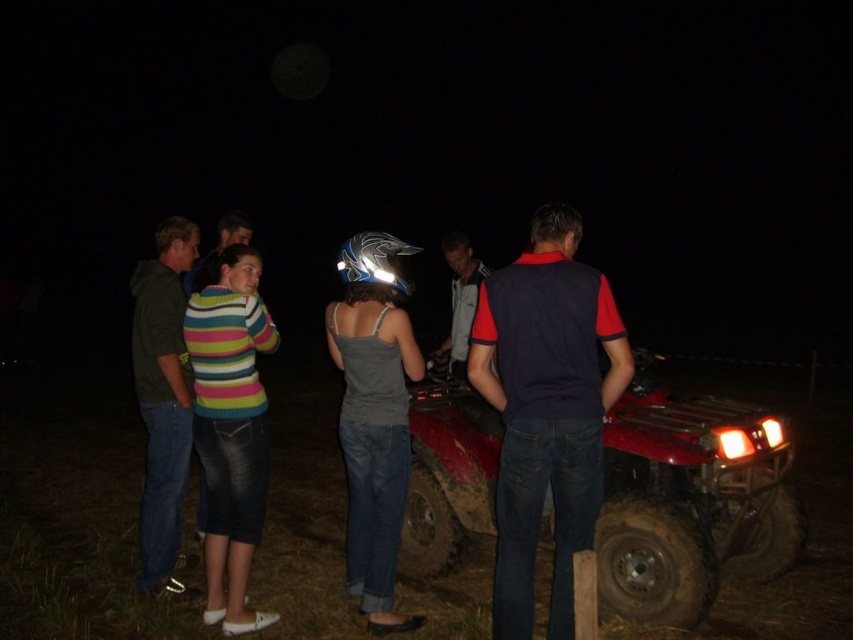
Question: Among these points, which one is farthest from the camera?

Choices:
 (A) (688, 516)
 (B) (164, 408)

Answer: (B)

Question: Where is dark green cotton shirt at left located in relation to gray fleece jacket at center in the image?

Choices:
 (A) left
 (B) right

Answer: (A)

Question: Which point is farther to the camera?

Choices:
 (A) (163, 440)
 (B) (389, 266)

Answer: (A)

Question: In this image, where is matte red quad bike at center located relative to matte gray tank top at center?

Choices:
 (A) left
 (B) right

Answer: (B)

Question: Which of the following is the farthest from the observer?

Choices:
 (A) striped sweater at center
 (B) gray fleece jacket at center
 (C) dark green cotton shirt at left
 (D) matte gray tank top at center

Answer: (B)

Question: Does matte red quad bike at center have a larger size compared to striped sweater at center?

Choices:
 (A) no
 (B) yes

Answer: (B)